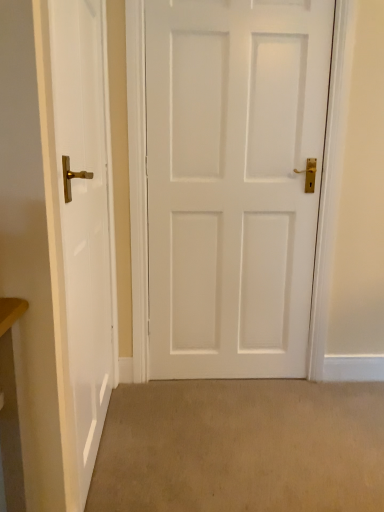
This screenshot has height=512, width=384. What are the coordinates of `free location to the right of white glossy door at left, the 2th door from the right` in the screenshot? It's located at (190, 457).